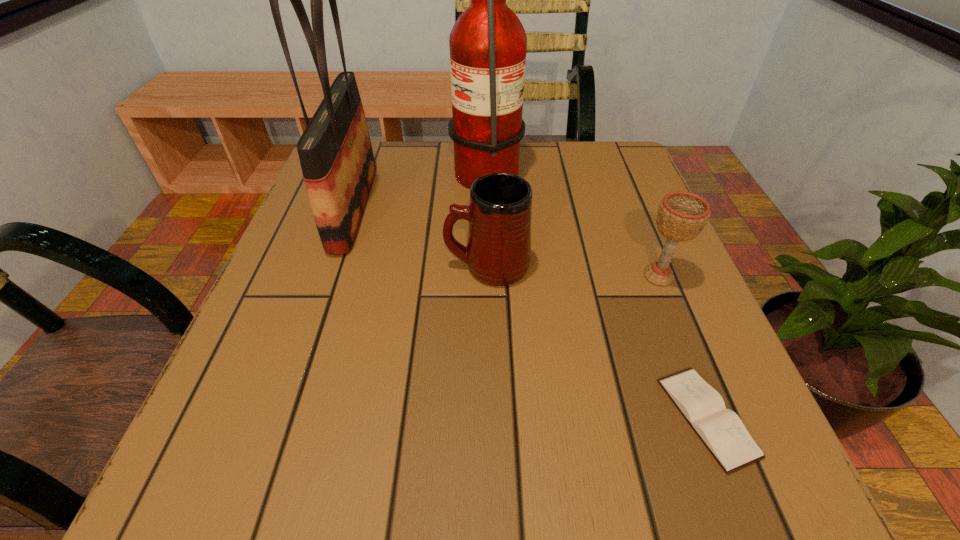
Image resolution: width=960 pixels, height=540 pixels. In order to click on object located at the far left corner in this screenshot , I will do `click(335, 152)`.

Identify the location of object that is positioned at the near right corner. This screenshot has width=960, height=540. (721, 430).

In the image, there is a desktop. Where is `vacant space at the far edge`? Image resolution: width=960 pixels, height=540 pixels. vacant space at the far edge is located at coordinates click(538, 140).

At what (x,y) coordinates should I click in order to perform the action: click on vacant space at the near edge. Please return your answer as a coordinate pair (x, y). Looking at the image, I should click on (329, 481).

I want to click on free space at the left edge, so click(x=309, y=280).

Locate an element on the screen. This screenshot has height=540, width=960. vacant space at the right edge is located at coordinates (762, 433).

Locate an element on the screen. This screenshot has height=540, width=960. free space at the far right corner of the desktop is located at coordinates (607, 151).

You are a GUI agent. You are given a task and a screenshot of the screen. Output one action in this format:
    pyautogui.click(x=<x>, y=<y>)
    Task: Click on the free space at the near right corner of the desktop
    The image size is (960, 540).
    Given the screenshot: What is the action you would take?
    pyautogui.click(x=770, y=487)

Locate an element on the screen. Image resolution: width=960 pixels, height=540 pixels. vacant area that lies between the mug and the leftmost object is located at coordinates (420, 237).

Where is `free space between the fire extinguisher and the chalice`? This screenshot has height=540, width=960. free space between the fire extinguisher and the chalice is located at coordinates (572, 221).